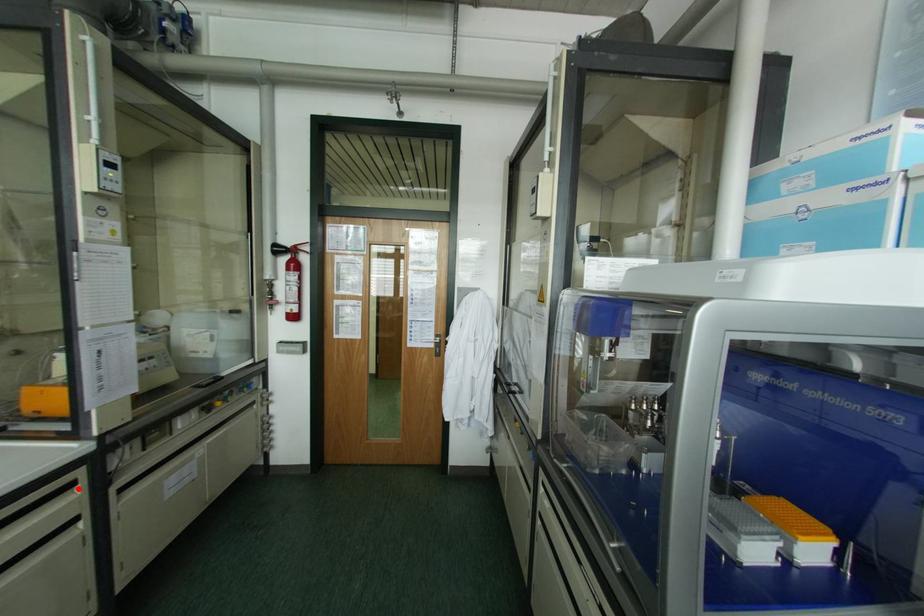
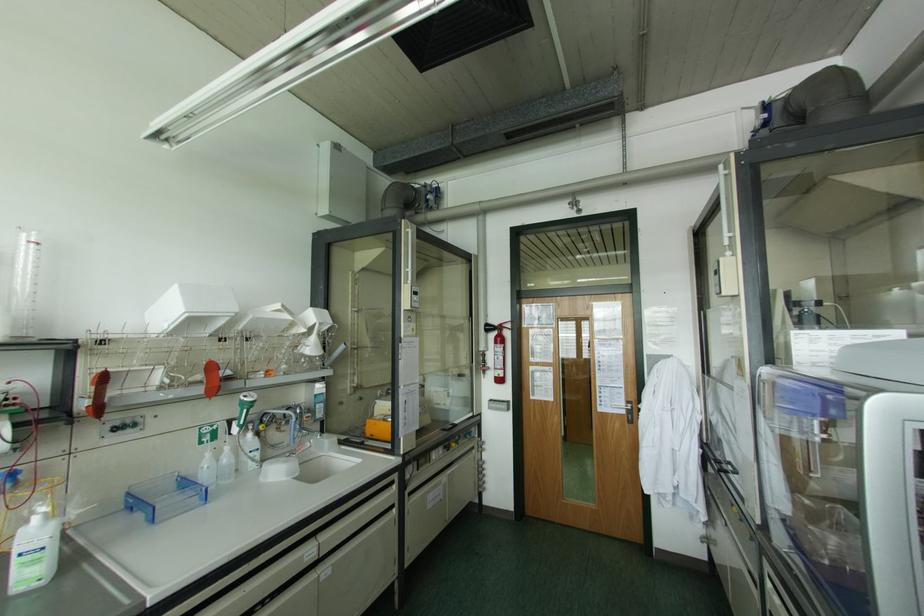
Question: I am providing you with two images of the same scene from different viewpoints. A red point is shown in image1. For the corresponding object point in image2, is it positioned nearer or farther from the camera?

Choices:
 (A) Nearer
 (B) Farther

Answer: (B)